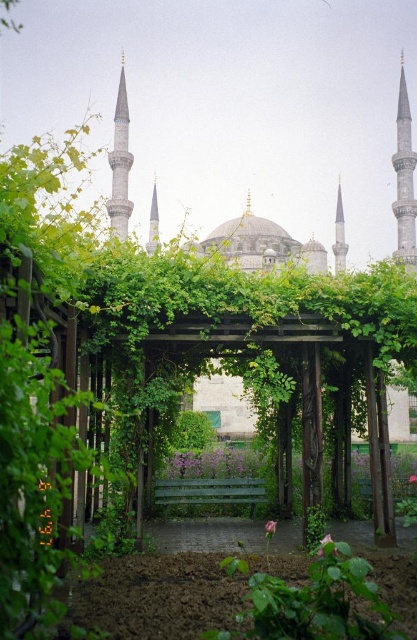
Question: Which object is closer to the camera taking this photo?

Choices:
 (A) pink matte rose at center
 (B) pink petal at center

Answer: (A)

Question: Which point appears closest to the camera in this image?

Choices:
 (A) (409, 481)
 (B) (321, 556)

Answer: (B)

Question: Is pink petal at center bigger than pink fabric flower at center?

Choices:
 (A) no
 (B) yes

Answer: (B)

Question: Can you confirm if pink matte rose at center is positioned below pink petal at center?

Choices:
 (A) no
 (B) yes

Answer: (A)

Question: Which point is closer to the camera?

Choices:
 (A) pink matte rose at center
 (B) pink petal at center
 (C) pink fabric flower at center

Answer: (A)

Question: Is pink matte rose at center smaller than pink petal at center?

Choices:
 (A) yes
 (B) no

Answer: (B)